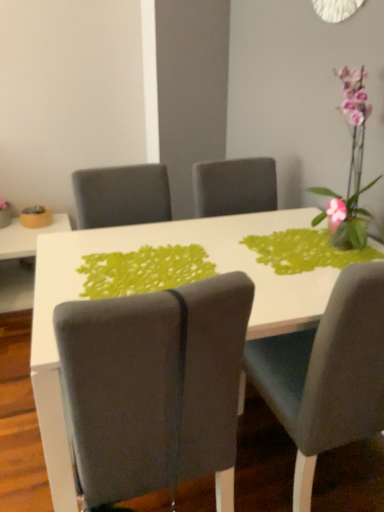
Where is `vacant area that lies to the right of green fabric placemat at center`? Image resolution: width=384 pixels, height=512 pixels. vacant area that lies to the right of green fabric placemat at center is located at coordinates (259, 274).